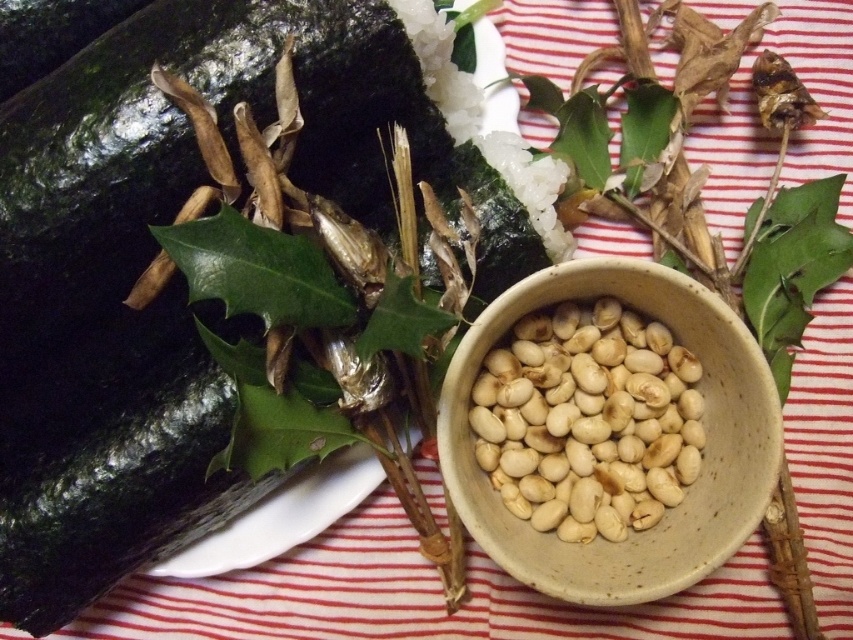
You are a chef preparing a dish and need to place the green matte cucumber at upper left and the white ceramic bowl at center on a shelf. If you want to arrange them so that the one closer to the front is the one that is closer to the viewer in the image, which object should you place in front?

The green matte cucumber at upper left should be placed in front because it is closer to the viewer than the white ceramic bowl at center in the image.

You are a chef preparing a dish and need to know the size of the ingredients. Which object is wider, the green matte cucumber at upper left or the white matte beans at center?

The green matte cucumber at upper left is wider than the white matte beans at center according to the description.